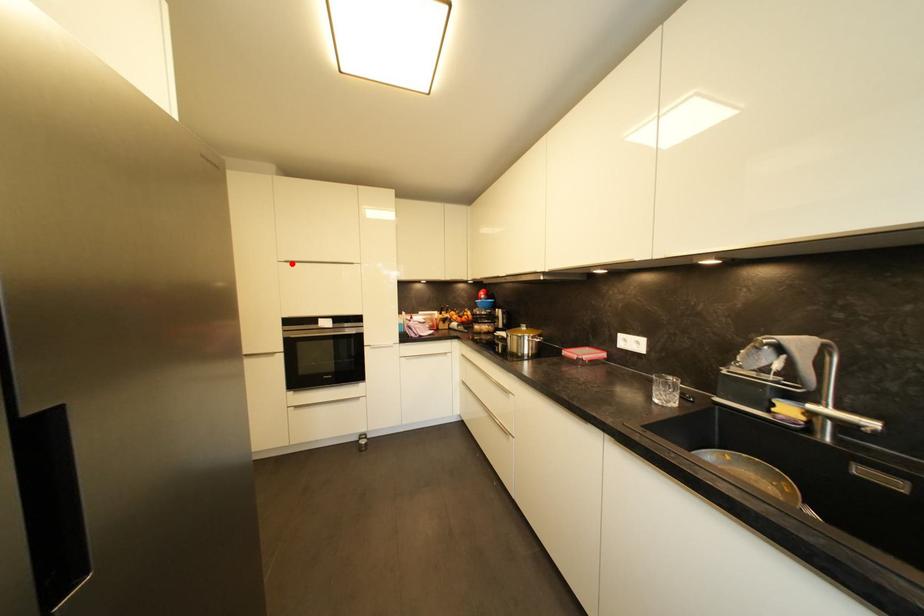
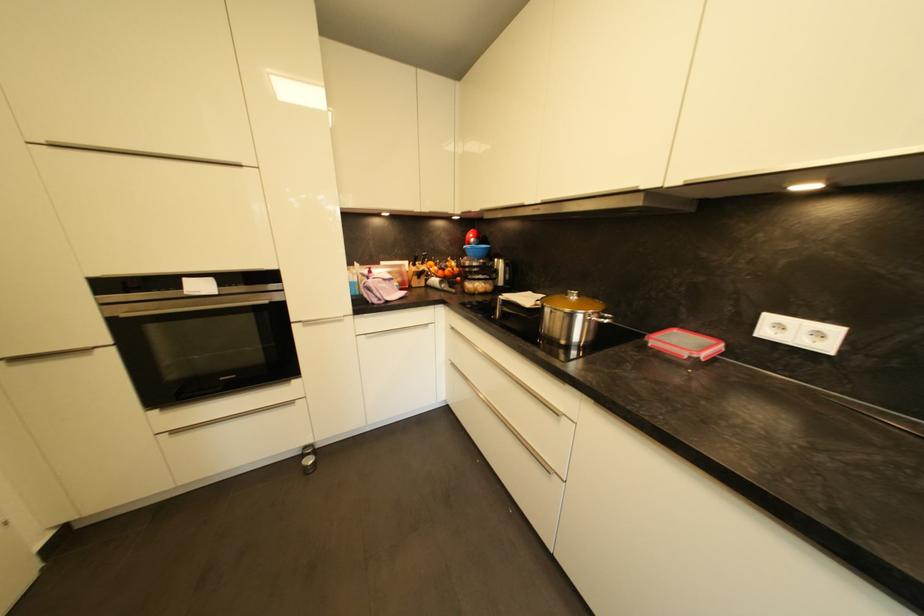
Find the pixel in the second image that matches the highlighted location in the first image.

(58, 148)